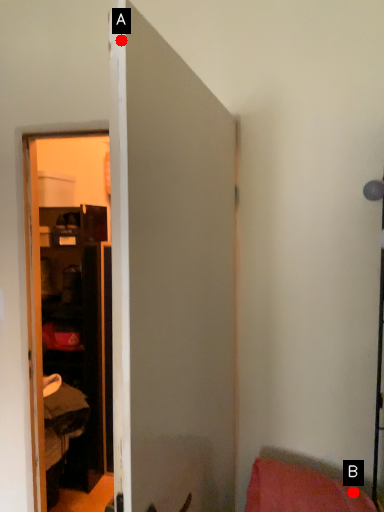
Question: Two points are circled on the image, labeled by A and B beside each circle. Among these points, which one is farthest from the camera?

Choices:
 (A) A is further
 (B) B is further

Answer: (B)